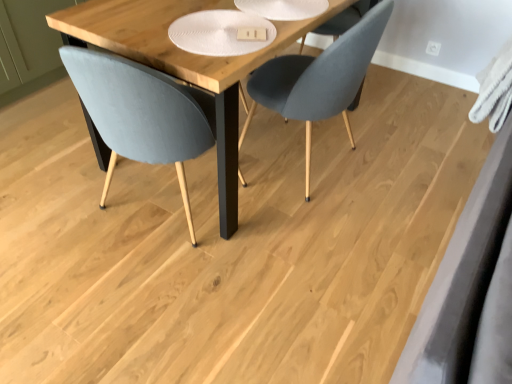
Find the location of a particular element. The image size is (512, 384). vacant area that is in front of wooden table at center is located at coordinates (229, 284).